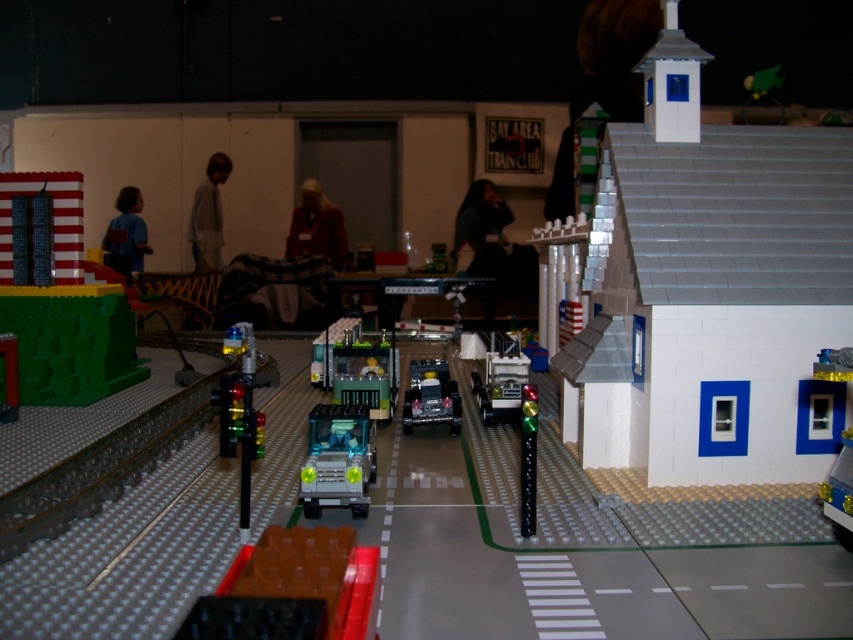
Which of these two, shiny silver car at center or light gray fabric shirt at center, stands taller?

light gray fabric shirt at center is taller.

This screenshot has width=853, height=640. Describe the element at coordinates (431, 396) in the screenshot. I see `shiny silver car at center` at that location.

Which is in front, point (416, 392) or point (199, 244)?

Positioned in front is point (416, 392).

Image resolution: width=853 pixels, height=640 pixels. What are the coordinates of `shiny silver car at center` in the screenshot? It's located at (431, 396).

Between metallic silver truck at center and shiny silver car at center, which one appears on the left side from the viewer's perspective?

shiny silver car at center

Can you confirm if metallic silver truck at center is taller than shiny silver car at center?

Correct, metallic silver truck at center is much taller as shiny silver car at center.

You are a GUI agent. You are given a task and a screenshot of the screen. Output one action in this format:
    pyautogui.click(x=<x>, y=<y>)
    Task: Click on the metallic silver truck at center
    The image size is (853, 640).
    Given the screenshot: What is the action you would take?
    pyautogui.click(x=498, y=376)

Can you confirm if translucent blue plastic car at center is wider than matte blue shirt at left?

No, translucent blue plastic car at center is not wider than matte blue shirt at left.

Does translucent blue plastic car at center appear on the left side of matte blue shirt at left?

In fact, translucent blue plastic car at center is to the right of matte blue shirt at left.

This screenshot has height=640, width=853. Find the location of `translucent blue plastic car at center`. translucent blue plastic car at center is located at coordinates (337, 460).

The height and width of the screenshot is (640, 853). Identify the location of translucent blue plastic car at center. 337,460.